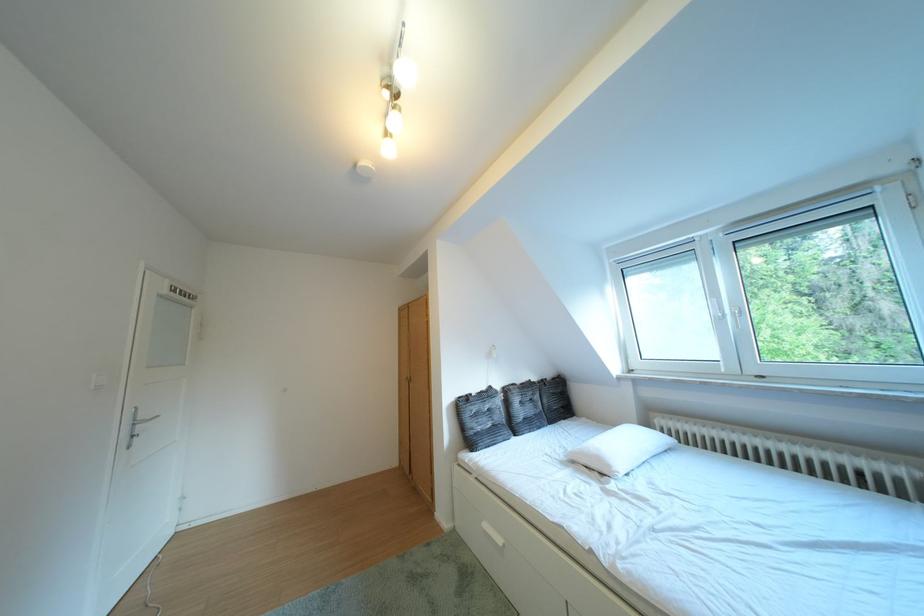
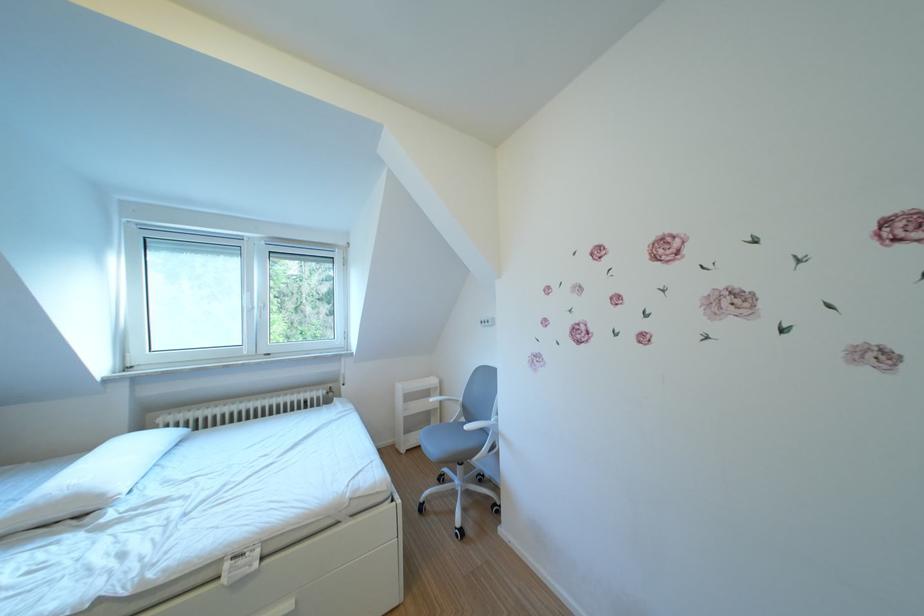
Find the pixel in the second image that matches point (736, 315) in the first image.

(265, 307)